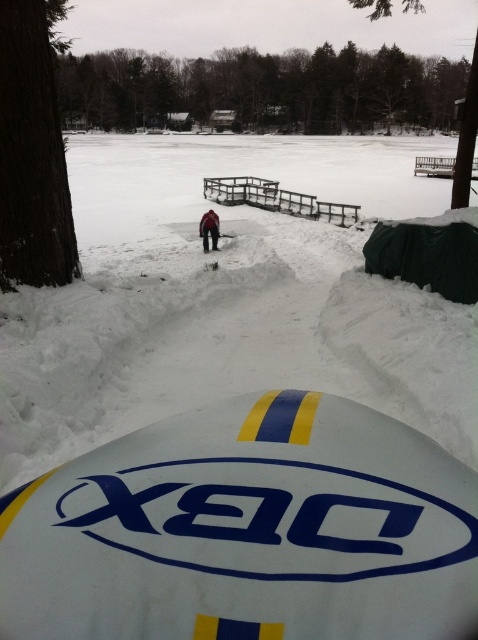
You are standing at the edge of the wooden dock and want to see the green leafy tree at upper center clearly. Is the dark brown fur coat at center blocking your view of the tree?

The green leafy tree at upper center is in front of the dark brown fur coat at center, so the fur coat is blocking your view of the tree.

You are planning to build a small shed in your backyard. The shed requires a 100 feet clearance from any trees and 150 feet from any wooden structures. Given the distances between the green leafy tree at upper center and the dark brown wood at left, can you place the shed between them?

The green leafy tree at upper center is 122.26 feet from the dark brown wood at left. Since the required clearance for trees is 100 feet and the distance between them is 122.26 feet, the shed can be placed between them as long as it maintains at least 100 feet from the tree and 150 feet from the wooden structure. However, the distance between the tree and the wood is insufficient for the 150 feet requirement for wooden structures, so the shed cannot be placed between them.